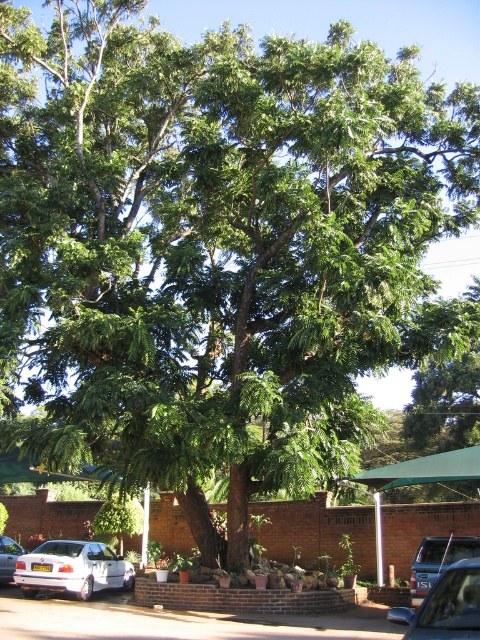
I want to click on metallic silver car at lower right, so click(x=445, y=605).

This screenshot has height=640, width=480. I want to click on metallic silver car at lower right, so click(x=445, y=605).

Does metallic gray suv at center have a lesser height compared to white matte car at lower left?

No, metallic gray suv at center is not shorter than white matte car at lower left.

Does metallic gray suv at center appear on the right side of white matte car at lower left?

Indeed, metallic gray suv at center is positioned on the right side of white matte car at lower left.

Between point (454, 544) and point (11, 540), which one is positioned in front?

Point (454, 544) is in front.

Where is `metallic gray suv at center`? The height and width of the screenshot is (640, 480). metallic gray suv at center is located at coordinates (437, 561).

Who is taller, white matte sedan at lower left or metallic gray suv at center?

white matte sedan at lower left

Which is more to the left, white matte sedan at lower left or metallic gray suv at center?

white matte sedan at lower left is more to the left.

The height and width of the screenshot is (640, 480). Identify the location of white matte sedan at lower left. (72, 568).

Find the location of `white matte sedan at lower left`. white matte sedan at lower left is located at coordinates (72, 568).